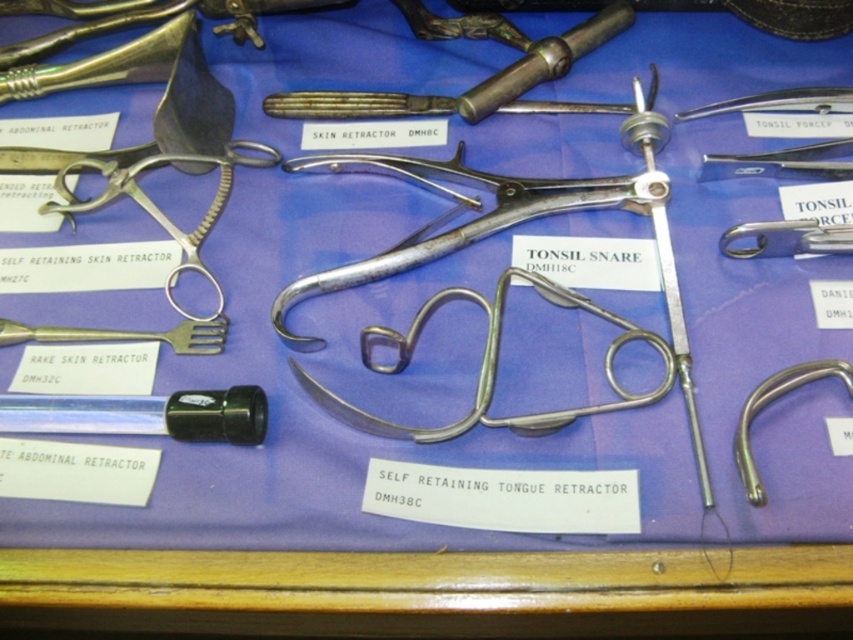
Question: Which object is closer to the camera taking this photo?

Choices:
 (A) matte silver scissors at upper left
 (B) black plastic tube at lower left

Answer: (B)

Question: Where is matte silver fork at left located in relation to silver metallic hook at right in the image?

Choices:
 (A) right
 (B) left

Answer: (B)

Question: Which point appears farthest from the camera in this image?

Choices:
 (A) (749, 401)
 (B) (26, 333)

Answer: (B)

Question: Can you confirm if black plastic tube at lower left is positioned below silver metallic forceps at upper right?

Choices:
 (A) no
 (B) yes

Answer: (B)

Question: Which of the following is the closest to the observer?

Choices:
 (A) matte silver scissors at upper left
 (B) matte silver fork at left
 (C) metallic silver scissors at center

Answer: (C)

Question: Is black plastic tube at lower left smaller than silver metallic forceps at upper right?

Choices:
 (A) yes
 (B) no

Answer: (B)